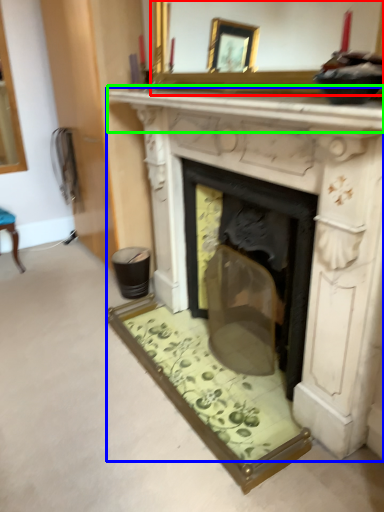
Question: Which is farther away from mirror (highlighted by a red box)? fireplace (highlighted by a blue box) or mantle (highlighted by a green box)?

Choices:
 (A) fireplace
 (B) mantle

Answer: (A)